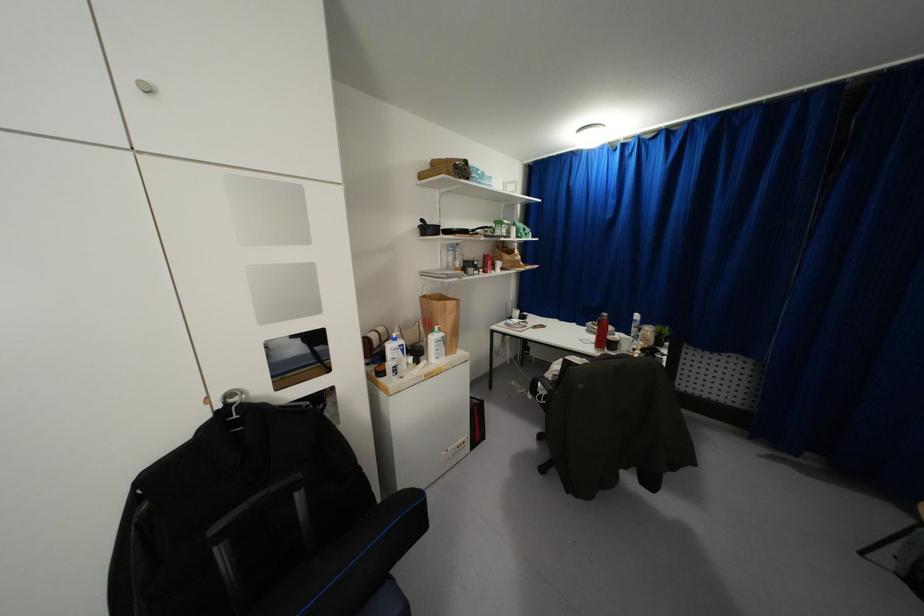
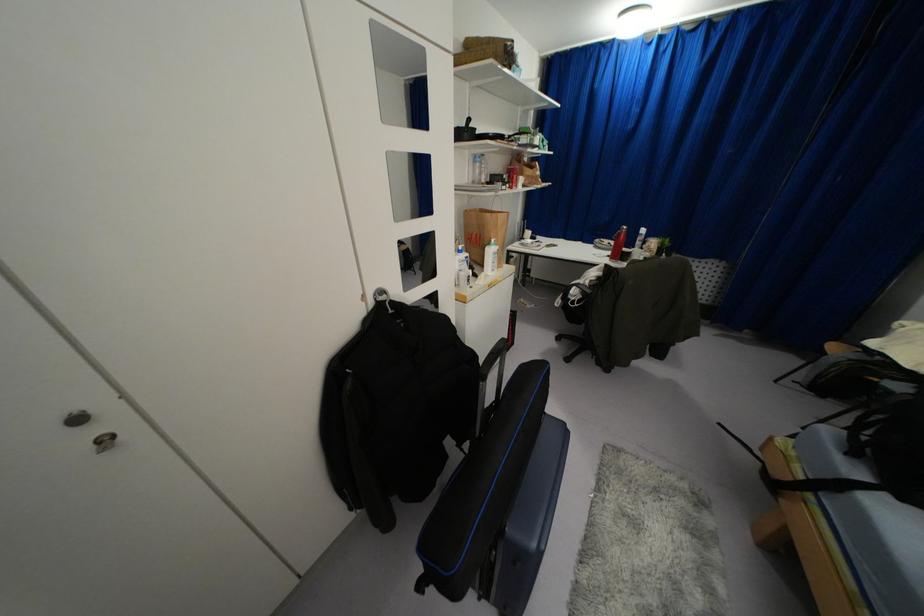
Where in the second image is the point corresponding to point (446, 249) from the first image?

(475, 161)